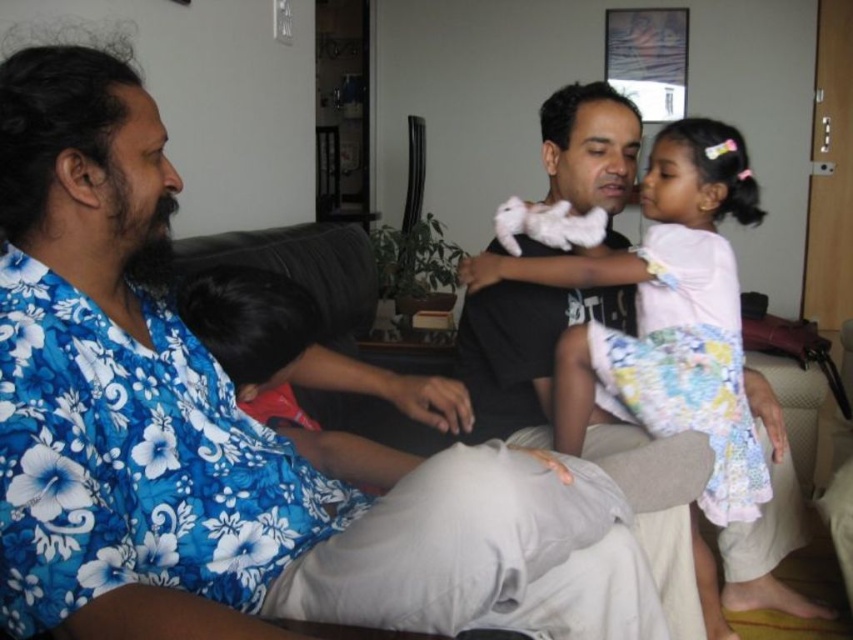
Looking at this image, you are a photographer setting up for a family photo. You notice the white cotton dress at center and the black fabric at left in the scene. Which object should you adjust to ensure both are visible in the frame without cropping?

The white cotton dress at center is much taller than the black fabric at left, so you should adjust the camera angle or position to accommodate the height of the white cotton dress at center to ensure both are fully visible.